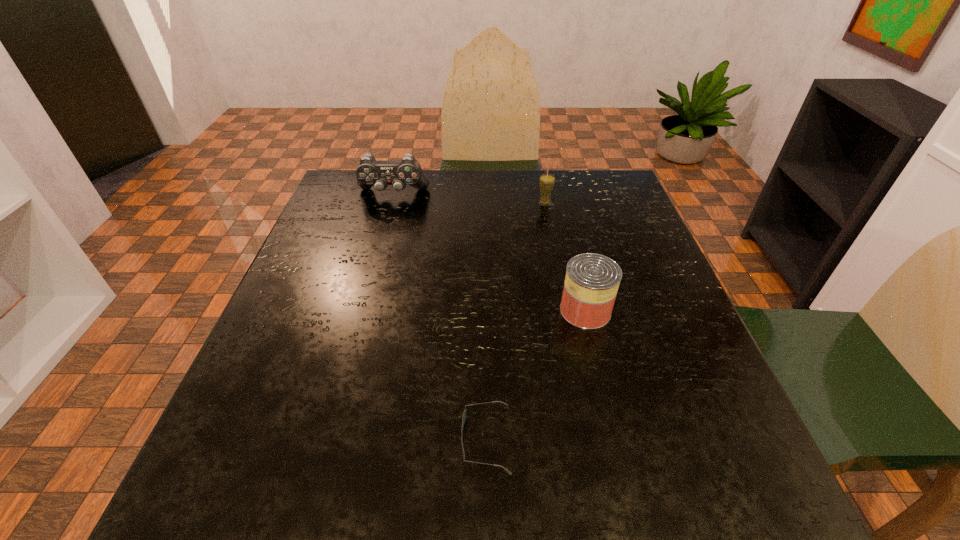
Where is `vacant area located 0.150m on the lenses of the nearest object`? The image size is (960, 540). vacant area located 0.150m on the lenses of the nearest object is located at coordinates (364, 439).

Where is `straw for drinking that is at the far edge`? The height and width of the screenshot is (540, 960). straw for drinking that is at the far edge is located at coordinates (546, 181).

Where is `control that is at the far edge`? This screenshot has height=540, width=960. control that is at the far edge is located at coordinates (370, 172).

Where is `object that is at the near edge`? object that is at the near edge is located at coordinates (464, 414).

Locate an element on the screen. The image size is (960, 540). object that is positioned at the left edge is located at coordinates (370, 172).

This screenshot has width=960, height=540. I want to click on object located in the right edge section of the desktop, so click(592, 280).

Identify the location of object located at the far left corner. (370, 172).

In the image, there is a desktop. What are the coordinates of `vacant area at the far edge` in the screenshot? It's located at (388, 211).

In the image, there is a desktop. At what (x,y) coordinates should I click in order to perform the action: click on vacant space at the near edge. Please return your answer as a coordinate pair (x, y). The image size is (960, 540). Looking at the image, I should click on (645, 526).

In the image, there is a desktop. Identify the location of vacant space at the left edge. (327, 362).